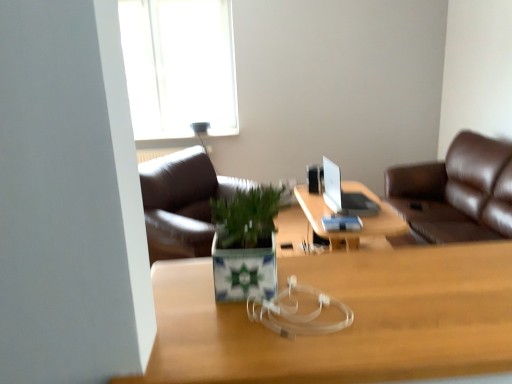
Where is `free point to the right of green ceramic pot at center`? free point to the right of green ceramic pot at center is located at coordinates (353, 297).